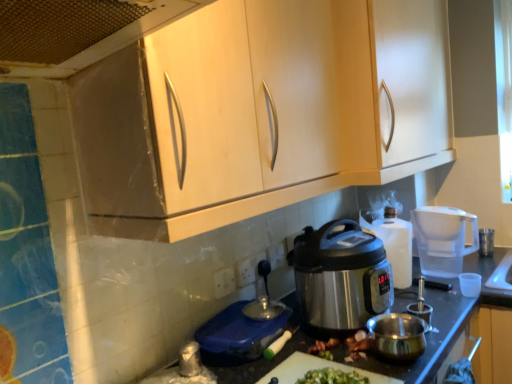
Where is `stainless steel pressure cooker at center`? The image size is (512, 384). stainless steel pressure cooker at center is located at coordinates (340, 276).

Measure the distance between blue plastic cutting board at lower center, the 4th appliance when ordered from back to front, and camera.

They are 1.12 meters apart.

Measure the distance between point [247,330] and camera.

Point [247,330] and camera are 1.20 meters apart.

What do you see at coordinates (108, 41) in the screenshot? Image resolution: width=512 pixels, height=384 pixels. I see `metallic mesh at upper left` at bounding box center [108, 41].

Measure the distance between white plastic power outlet at center, the 1th power outlet positioned from the right, and camera.

They are 5.00 feet apart.

Locate an element on the screen. satin silver pot at center, which is the 3th appliance from right to left is located at coordinates (422, 307).

Where is `stainless steel pressure cooker at center`? This screenshot has height=384, width=512. stainless steel pressure cooker at center is located at coordinates (340, 276).

Measure the distance from matte wood cabinets at upper center, placed as the 1th cabinetry when sorted from front to back, to metallic mesh at upper left.

matte wood cabinets at upper center, placed as the 1th cabinetry when sorted from front to back, is 15.35 inches away from metallic mesh at upper left.

Image resolution: width=512 pixels, height=384 pixels. I want to click on exhaust hood that is above the matte wood cabinets at upper center, which is counted as the 2th cabinetry, starting from the back (from the image's perspective), so click(108, 41).

Which of these two, matte wood cabinets at upper center, placed as the 1th cabinetry when sorted from front to back, or metallic mesh at upper left, is thinner?

With smaller width is matte wood cabinets at upper center, placed as the 1th cabinetry when sorted from front to back.

Considering the points (429, 49) and (70, 73), which point is behind, point (429, 49) or point (70, 73)?

The point (429, 49) is farther from the camera.

From the picture: How many degrees apart are the facing directions of blue plastic cutting board at lower center, the 1th appliance in the left-to-right sequence, and satin metallic pressure cooker at center, the second appliance from the right?

The angle between the facing direction of blue plastic cutting board at lower center, the 1th appliance in the left-to-right sequence, and the facing direction of satin metallic pressure cooker at center, the second appliance from the right, is 6.77 degrees.

Is blue plastic cutting board at lower center, the 4th appliance viewed from the right, not inside satin metallic pressure cooker at center, placed as the third appliance when sorted from left to right?

Yes.

Who is bigger, blue plastic cutting board at lower center, the 1th appliance in the left-to-right sequence, or satin metallic pressure cooker at center, which ranks as the second appliance in back-to-front order?

With larger size is satin metallic pressure cooker at center, which ranks as the second appliance in back-to-front order.

Is blue plastic cutting board at lower center, the 1th appliance in the left-to-right sequence, oriented away from satin metallic pressure cooker at center, which ranks as the second appliance in back-to-front order?

No, blue plastic cutting board at lower center, the 1th appliance in the left-to-right sequence,'s orientation is not away from satin metallic pressure cooker at center, which ranks as the second appliance in back-to-front order.

Would you say white plastic power outlet at center, marked as the first power outlet in a back-to-front arrangement, is part of satin silver pot at center, arranged as the third appliance when viewed from the back,'s contents?

No, satin silver pot at center, arranged as the third appliance when viewed from the back, does not contain white plastic power outlet at center, marked as the first power outlet in a back-to-front arrangement.

Does satin silver pot at center, arranged as the third appliance when viewed from the back, have a greater height compared to white plastic power outlet at center, marked as the first power outlet in a back-to-front arrangement?

Yes.

Relative to white plastic power outlet at center, the third power outlet in the front-to-back sequence, is satin silver pot at center, which ranks as the second appliance in left-to-right order, in front or behind?

In the image, satin silver pot at center, which ranks as the second appliance in left-to-right order, appears in front of white plastic power outlet at center, the third power outlet in the front-to-back sequence.

Is satin silver pot at center, which is the 3th appliance from right to left, facing away from white plastic power outlet at center, marked as the first power outlet in a back-to-front arrangement?

satin silver pot at center, which is the 3th appliance from right to left, does not have its back to white plastic power outlet at center, marked as the first power outlet in a back-to-front arrangement.

How distant is transparent plastic water filter at right from white plastic power outlet at center, the 3th power outlet from the right?

A distance of 80.79 centimeters exists between transparent plastic water filter at right and white plastic power outlet at center, the 3th power outlet from the right.

Does transparent plastic water filter at right lie in front of white plastic power outlet at center, which ranks as the 1th power outlet in front-to-back order?

No, the depth of transparent plastic water filter at right is greater than that of white plastic power outlet at center, which ranks as the 1th power outlet in front-to-back order.

Is transparent plastic water filter at right placed right next to white plastic power outlet at center, which ranks as the 1th power outlet in front-to-back order?

No, transparent plastic water filter at right is not touching white plastic power outlet at center, which ranks as the 1th power outlet in front-to-back order.

Which is in front, point (463, 226) or point (220, 272)?

Positioned in front is point (220, 272).

Can white plastic power outlet at center, the second power outlet viewed from the left, be found inside stainless steel pressure cooker at center?

No, white plastic power outlet at center, the second power outlet viewed from the left, is not inside stainless steel pressure cooker at center.

Relative to white plastic power outlet at center, the second power outlet viewed from the right, is stainless steel pressure cooker at center in front or behind?

stainless steel pressure cooker at center is positioned closer to the viewer than white plastic power outlet at center, the second power outlet viewed from the right.

I want to click on the 2nd power outlet to the left of the stainless steel pressure cooker at center, starting your count from the anchor, so [246, 271].

From a real-world perspective, is matte wood cabinets at upper center, which is counted as the 2th cabinetry, starting from the back, physically below transparent plastic water filter at right?

Actually, matte wood cabinets at upper center, which is counted as the 2th cabinetry, starting from the back, is physically above transparent plastic water filter at right in the real world.

Can you confirm if matte wood cabinets at upper center, which is counted as the 2th cabinetry, starting from the back, is smaller than transparent plastic water filter at right?

Incorrect, matte wood cabinets at upper center, which is counted as the 2th cabinetry, starting from the back, is not smaller in size than transparent plastic water filter at right.

Considering the relative sizes of matte wood cabinets at upper center, placed as the 1th cabinetry when sorted from front to back, and transparent plastic water filter at right in the image provided, is matte wood cabinets at upper center, placed as the 1th cabinetry when sorted from front to back, thinner than transparent plastic water filter at right?

No, matte wood cabinets at upper center, placed as the 1th cabinetry when sorted from front to back, is not thinner than transparent plastic water filter at right.

Considering the relative sizes of matte wood cabinets at upper center, placed as the 1th cabinetry when sorted from front to back, and transparent plastic water filter at right in the image provided, is matte wood cabinets at upper center, placed as the 1th cabinetry when sorted from front to back, shorter than transparent plastic water filter at right?

In fact, matte wood cabinets at upper center, placed as the 1th cabinetry when sorted from front to back, may be taller than transparent plastic water filter at right.

Is white plastic power outlet at center, which ranks as the 1th power outlet in front-to-back order, to the left of stainless steel pressure cooker at center from the viewer's perspective?

Yes.

From a real-world perspective, is white plastic power outlet at center, which ranks as the 1th power outlet in front-to-back order, below stainless steel pressure cooker at center?

Yes, from a real-world perspective, white plastic power outlet at center, which ranks as the 1th power outlet in front-to-back order, is beneath stainless steel pressure cooker at center.

Is white plastic power outlet at center, arranged as the third power outlet when viewed from the back, beside stainless steel pressure cooker at center?

No, white plastic power outlet at center, arranged as the third power outlet when viewed from the back, is not touching stainless steel pressure cooker at center.

In terms of size, does white plastic power outlet at center, the 3th power outlet from the right, appear bigger or smaller than stainless steel pressure cooker at center?

In the image, white plastic power outlet at center, the 3th power outlet from the right, appears to be smaller than stainless steel pressure cooker at center.

The height and width of the screenshot is (384, 512). I want to click on exhaust hood above the matte wood cabinets at upper center, placed as the 1th cabinetry when sorted from front to back (from a real-world perspective), so click(108, 41).

Starting from the blue plastic cutting board at lower center, the 4th appliance when ordered from back to front, which appliance is the 2nd one to the right? Please provide its 2D coordinates.

[(394, 244)]

Based on their spatial positions, is transparent plastic water filter at right or satin silver cup at right, the 4th appliance when ordered from front to back, further from stainless steel pressure cooker at center?

satin silver cup at right, the 4th appliance when ordered from front to back, is further to stainless steel pressure cooker at center.

Considering their positions, is transparent plastic water filter at right positioned further to white plastic power outlet at center, arranged as the third power outlet when viewed from the back, than white plastic power outlet at center, the second power outlet viewed from the right?

transparent plastic water filter at right.

Based on their spatial positions, is transparent plastic water filter at right or metallic mesh at upper left further from satin metallic pressure cooker at center, placed as the third appliance when sorted from left to right?

metallic mesh at upper left is positioned further to the anchor satin metallic pressure cooker at center, placed as the third appliance when sorted from left to right.

When comparing their distances from metallic mesh at upper left, does matte wood cabinet at upper center, the 1th cabinetry when ordered from back to front, or satin silver cup at right, the first appliance in the back-to-front sequence, seem closer?

matte wood cabinet at upper center, the 1th cabinetry when ordered from back to front.

From the image, which object appears to be nearer to transparent plastic water filter at right, white plastic power outlet at center, the second power outlet viewed from the left, or blue plastic cutting board at lower center, the 1th appliance in the left-to-right sequence?

white plastic power outlet at center, the second power outlet viewed from the left, lies closer to transparent plastic water filter at right than the other object.

Considering their positions, is satin metallic pressure cooker at center, placed as the third appliance when sorted from left to right, positioned closer to metallic mesh at upper left than white plastic power outlet at center, arranged as the third power outlet when viewed from the back?

The object closer to metallic mesh at upper left is white plastic power outlet at center, arranged as the third power outlet when viewed from the back.

From the image, which object appears to be nearer to stainless steel pressure cooker at center, metallic mesh at upper left or matte wood cabinet at upper center, the 1th cabinetry when ordered from back to front?

Based on the image, matte wood cabinet at upper center, the 1th cabinetry when ordered from back to front, appears to be nearer to stainless steel pressure cooker at center.

Consider the image. When comparing their distances from white plastic power outlet at center, the second power outlet viewed from the right, does stainless steel pressure cooker at center or metallic mesh at upper left seem further?

metallic mesh at upper left.

Identify the location of home appliance between blue plastic cutting board at lower center, the 1th appliance in the left-to-right sequence, and satin silver pot at center, which ranks as the second appliance in left-to-right order. The image size is (512, 384). (340, 276).

Find the location of `home appliance positioned between metallic mesh at upper left and satin silver pot at center, which is the 3th appliance from right to left, from near to far`. home appliance positioned between metallic mesh at upper left and satin silver pot at center, which is the 3th appliance from right to left, from near to far is located at coordinates (340, 276).

Locate an element on the screen. The height and width of the screenshot is (384, 512). kitchen appliance between white plastic power outlet at center, the 3th power outlet from the right, and satin silver cup at right, which is the fourth appliance in left-to-right order is located at coordinates (443, 239).

You are a GUI agent. You are given a task and a screenshot of the screen. Output one action in this format:
    pyautogui.click(x=<x>, y=<y>)
    Task: Click on the appliance between matte wood cabinets at upper center, placed as the 1th cabinetry when sorted from front to back, and satin silver pot at center, arranged as the third appliance when viewed from the back, from front to back
    The height and width of the screenshot is (384, 512).
    Given the screenshot: What is the action you would take?
    point(237,335)